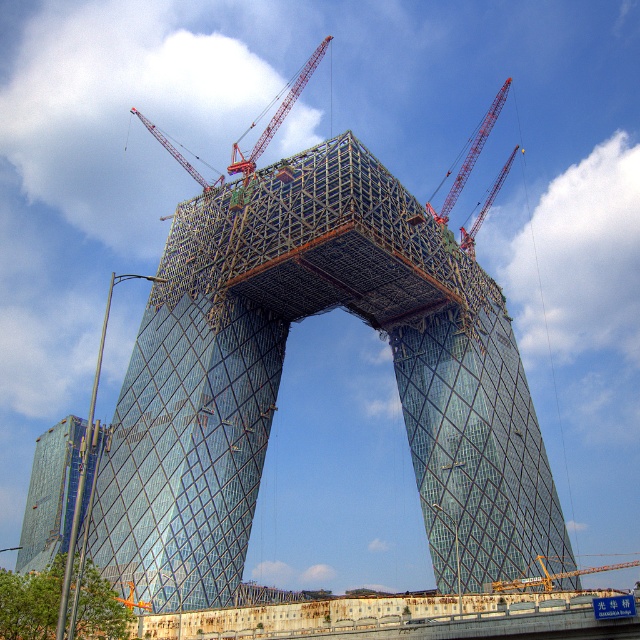
Describe the element at coordinates (51, 493) in the screenshot. I see `transparent glass skyscraper at left` at that location.

The image size is (640, 640). I want to click on transparent glass skyscraper at left, so click(51, 493).

Identify the location of transparent glass skyscraper at left. This screenshot has height=640, width=640. (51, 493).

Can you confirm if metallic red crane at upper center is positioned above red metal crane at upper right?

Indeed, metallic red crane at upper center is positioned over red metal crane at upper right.

Is metallic red crane at upper center wider than red metal crane at upper right?

Yes, metallic red crane at upper center is wider than red metal crane at upper right.

Where is `metallic red crane at upper center`? This screenshot has height=640, width=640. metallic red crane at upper center is located at coordinates (468, 154).

Between transparent glass skyscraper at left and yellow metallic crane at center, which one is positioned higher?

transparent glass skyscraper at left is higher up.

Is transparent glass skyscraper at left wider than yellow metallic crane at center?

Incorrect, transparent glass skyscraper at left's width does not surpass yellow metallic crane at center's.

Between point (51, 502) and point (502, 584), which one is positioned in front?

Point (502, 584) is more forward.

Where is `transparent glass skyscraper at left`? transparent glass skyscraper at left is located at coordinates (51, 493).